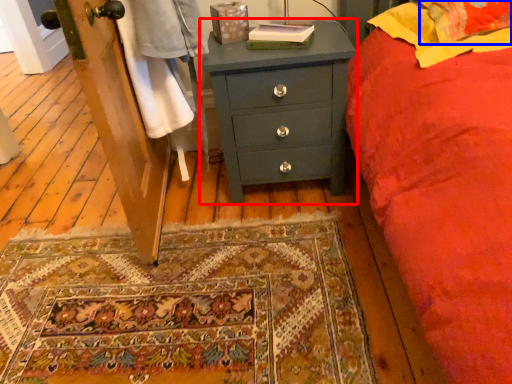
Question: Which of the following is the farthest to the observer, chest of drawers (highlighted by a red box) or pillow (highlighted by a blue box)?

Choices:
 (A) chest of drawers
 (B) pillow

Answer: (A)